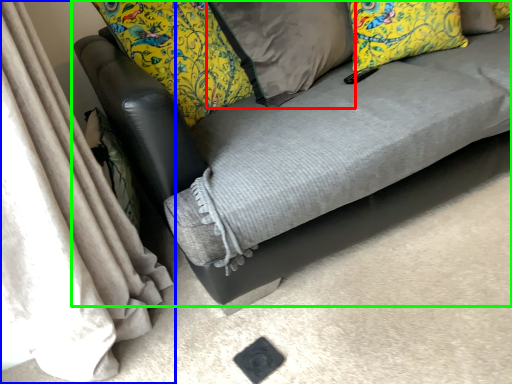
Question: Based on their relative distances, which object is nearer to pillow (highlighted by a red box)? Choose from curtain (highlighted by a blue box) and studio couch (highlighted by a green box).

Choices:
 (A) curtain
 (B) studio couch

Answer: (B)